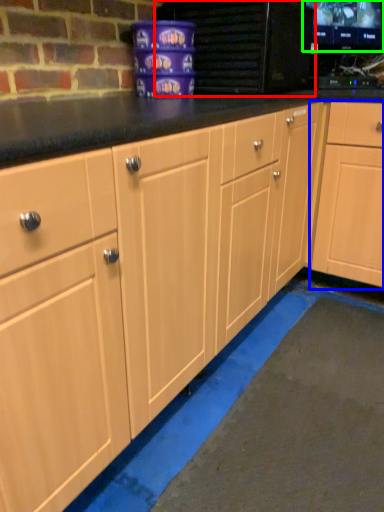
Question: Which object is positioned closest to appliance (highlighted by a red box)? Select from cabinetry (highlighted by a blue box) and computer monitor (highlighted by a green box).

Choices:
 (A) cabinetry
 (B) computer monitor

Answer: (A)